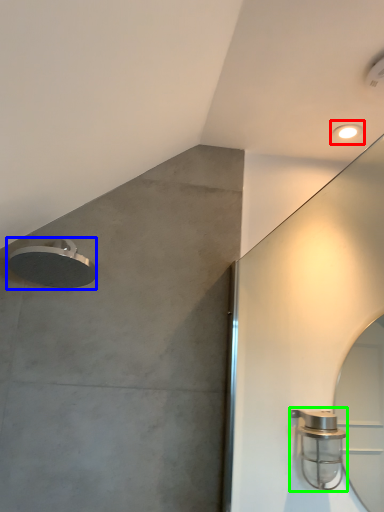
Question: Which object is the farthest from droplight (highlighted by a red box)? Choose among these: shower (highlighted by a blue box) or shower (highlighted by a green box).

Choices:
 (A) shower
 (B) shower

Answer: (A)